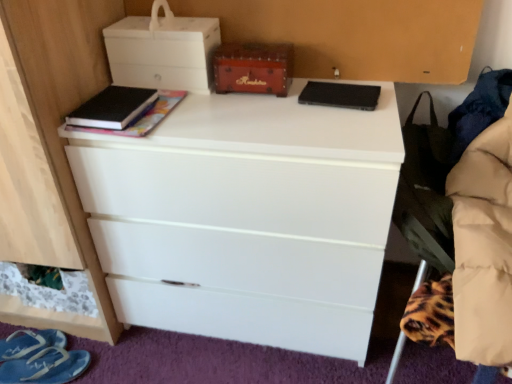
The width and height of the screenshot is (512, 384). In order to click on free location above blue fabric slipper at lower left, which is the 1th footwear in front-to-back order (from a real-world perspective) in this screenshot , I will do `click(35, 363)`.